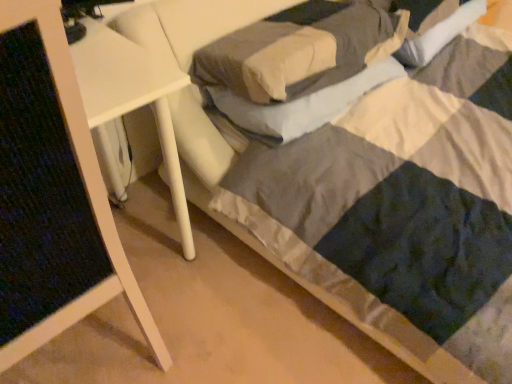
From the picture: In order to face white glossy side table at upper left, should I rotate leftwards or rightwards?

You should look left and rotate roughly 26.211 degrees.

This screenshot has width=512, height=384. What do you see at coordinates (52, 194) in the screenshot? I see `white glossy side table at upper left` at bounding box center [52, 194].

Image resolution: width=512 pixels, height=384 pixels. I want to click on soft gray pillow at center, arranged as the 1th pillow when viewed from the top, so click(x=300, y=50).

Image resolution: width=512 pixels, height=384 pixels. I want to click on soft white pillow at center, the 1th pillow positioned from the bottom, so click(298, 105).

Is white glossy side table at upper left bigger than soft gray pillow at center, acting as the 2th pillow starting from the bottom?

Indeed, white glossy side table at upper left has a larger size compared to soft gray pillow at center, acting as the 2th pillow starting from the bottom.

What are the coordinates of `the 1st pillow to the right when counting from the white glossy side table at upper left` in the screenshot? It's located at 300,50.

Could you tell me if white glossy side table at upper left is turned towards soft gray pillow at center, arranged as the 1th pillow when viewed from the top?

No.

Looking at this image, does white glossy side table at upper left have a greater width compared to soft gray pillow at center, acting as the 2th pillow starting from the bottom?

Correct, the width of white glossy side table at upper left exceeds that of soft gray pillow at center, acting as the 2th pillow starting from the bottom.

The width and height of the screenshot is (512, 384). Find the location of `pillow behind the soft gray pillow at center, acting as the 2th pillow starting from the bottom`. pillow behind the soft gray pillow at center, acting as the 2th pillow starting from the bottom is located at coordinates pos(298,105).

From the image's perspective, between soft gray pillow at center, acting as the 2th pillow starting from the bottom, and soft white pillow at center, the 2th pillow in the top-to-bottom sequence, which one is located above?

soft gray pillow at center, acting as the 2th pillow starting from the bottom, from the image's perspective.

Is soft gray pillow at center, arranged as the 1th pillow when viewed from the top, situated inside soft white pillow at center, the 1th pillow positioned from the bottom, or outside?

soft gray pillow at center, arranged as the 1th pillow when viewed from the top, is located beyond the bounds of soft white pillow at center, the 1th pillow positioned from the bottom.

Between white glossy side table at upper left and soft white pillow at center, the 2th pillow in the top-to-bottom sequence, which one has smaller width?

With smaller width is soft white pillow at center, the 2th pillow in the top-to-bottom sequence.

From the image's perspective, which is below, white glossy side table at upper left or soft white pillow at center, the 2th pillow in the top-to-bottom sequence?

From the image's view, white glossy side table at upper left is below.

Between white glossy side table at upper left and soft white pillow at center, the 1th pillow positioned from the bottom, which one has larger size?

With larger size is white glossy side table at upper left.

What are the coordinates of `furniture located on the left of soft white pillow at center, the 2th pillow in the top-to-bottom sequence` in the screenshot? It's located at (52, 194).

Does point (302, 94) appear closer or farther from the camera than point (378, 19)?

Point (302, 94) is closer to the camera than point (378, 19).

How much distance is there between soft white pillow at center, the 2th pillow in the top-to-bottom sequence, and soft gray pillow at center, arranged as the 1th pillow when viewed from the top?

They are 10.08 centimeters apart.

Is soft white pillow at center, the 2th pillow in the top-to-bottom sequence, next to soft gray pillow at center, acting as the 2th pillow starting from the bottom?

There is a gap between soft white pillow at center, the 2th pillow in the top-to-bottom sequence, and soft gray pillow at center, acting as the 2th pillow starting from the bottom.

Which is more to the left, soft white pillow at center, the 1th pillow positioned from the bottom, or soft gray pillow at center, acting as the 2th pillow starting from the bottom?

From the viewer's perspective, soft gray pillow at center, acting as the 2th pillow starting from the bottom, appears more on the left side.

Is soft gray pillow at center, arranged as the 1th pillow when viewed from the top, at the right side of white glossy side table at upper left?

Indeed, soft gray pillow at center, arranged as the 1th pillow when viewed from the top, is positioned on the right side of white glossy side table at upper left.

From a real-world perspective, which object stands above the other?

soft gray pillow at center, arranged as the 1th pillow when viewed from the top, is physically above.

Which of these two, soft gray pillow at center, arranged as the 1th pillow when viewed from the top, or white glossy side table at upper left, stands taller?

With more height is white glossy side table at upper left.

Could you tell me if soft gray pillow at center, arranged as the 1th pillow when viewed from the top, is turned towards white glossy side table at upper left?

No, soft gray pillow at center, arranged as the 1th pillow when viewed from the top, is not oriented towards white glossy side table at upper left.

Can you confirm if soft white pillow at center, the 1th pillow positioned from the bottom, is positioned to the left of white glossy side table at upper left?

No.

Does soft white pillow at center, the 2th pillow in the top-to-bottom sequence, have a smaller size compared to white glossy side table at upper left?

Yes.

Which pillow is the 1st one when counting from the right side of the white glossy side table at upper left? Please provide its 2D coordinates.

[(300, 50)]

Locate an element on the screen. pillow behind the soft gray pillow at center, acting as the 2th pillow starting from the bottom is located at coordinates (298, 105).

Consider the image. From the image, which object appears to be farther from soft gray pillow at center, arranged as the 1th pillow when viewed from the top, white glossy side table at upper left or soft white pillow at center, the 1th pillow positioned from the bottom?

white glossy side table at upper left is further to soft gray pillow at center, arranged as the 1th pillow when viewed from the top.

From the image, which object appears to be farther from white glossy side table at upper left, soft gray pillow at center, acting as the 2th pillow starting from the bottom, or soft white pillow at center, the 1th pillow positioned from the bottom?

soft gray pillow at center, acting as the 2th pillow starting from the bottom.

Considering their positions, is soft white pillow at center, the 2th pillow in the top-to-bottom sequence, positioned closer to soft gray pillow at center, arranged as the 1th pillow when viewed from the top, than white glossy side table at upper left?

Among the two, soft white pillow at center, the 2th pillow in the top-to-bottom sequence, is located nearer to soft gray pillow at center, arranged as the 1th pillow when viewed from the top.

Considering their positions, is soft gray pillow at center, arranged as the 1th pillow when viewed from the top, positioned closer to soft white pillow at center, the 2th pillow in the top-to-bottom sequence, than white glossy side table at upper left?

Among the two, soft gray pillow at center, arranged as the 1th pillow when viewed from the top, is located nearer to soft white pillow at center, the 2th pillow in the top-to-bottom sequence.

Looking at the image, which one is located further to white glossy side table at upper left, soft white pillow at center, the 1th pillow positioned from the bottom, or soft gray pillow at center, acting as the 2th pillow starting from the bottom?

soft gray pillow at center, acting as the 2th pillow starting from the bottom, is further to white glossy side table at upper left.

Which object lies further to the anchor point soft white pillow at center, the 2th pillow in the top-to-bottom sequence, white glossy side table at upper left or soft gray pillow at center, acting as the 2th pillow starting from the bottom?

white glossy side table at upper left.

Identify the location of pillow situated between white glossy side table at upper left and soft white pillow at center, the 1th pillow positioned from the bottom, from left to right. This screenshot has width=512, height=384. (300, 50).